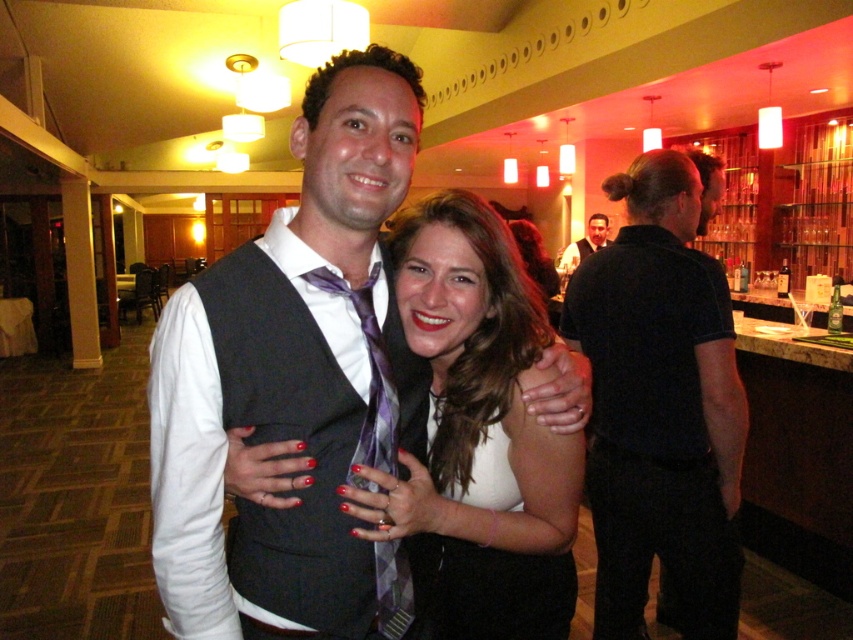
You are a photographer at the event and want to capture a photo of the matte black vest at center and the black smooth shirt at right. Which one is positioned to the left side of the other?

The matte black vest at center is to the left of the black smooth shirt at right.

You are a photographer at the event and want to take a photo focusing on the matte black dress at center and the white matte dress at center. Which dress will appear larger in the photo?

The matte black dress at center will appear larger in the photo because it is closer to the viewer than the white matte dress at center.

You are at a party and want to find the matte black dress at center. Where should you look relative to the white matte dress at center?

The matte black dress at center is located to the left of the white matte dress at center.